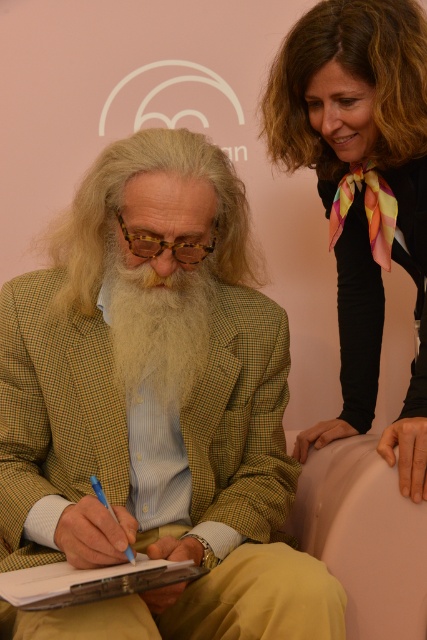
You are a photographer setting up for a portrait session. You notice the blue plastic pen at lower left and the smooth beige armchair at lower center. To ensure the pen is visible in the photo, should you adjust your camera to focus on the foreground or background?

The blue plastic pen at lower left is behind the smooth beige armchair at lower center, so to make the pen visible, you should focus on the background where the pen is located.

You are standing at point (x=330, y=84) and want to walk to point (x=117, y=246). Is the path clear? Please explain.

Yes, the path is clear because point (x=117, y=246) is in front of point (x=330, y=84), so there are no obstructions between them.

You are a furniture designer trying to place a blue plastic pen at lower left on the smooth beige armchair at lower center. Based on the scene description, will the pen fit on the armchair?

The smooth beige armchair at lower center is taller than blue plastic pen at lower left, so the pen will likely fit on the armchair since it is shorter in height.